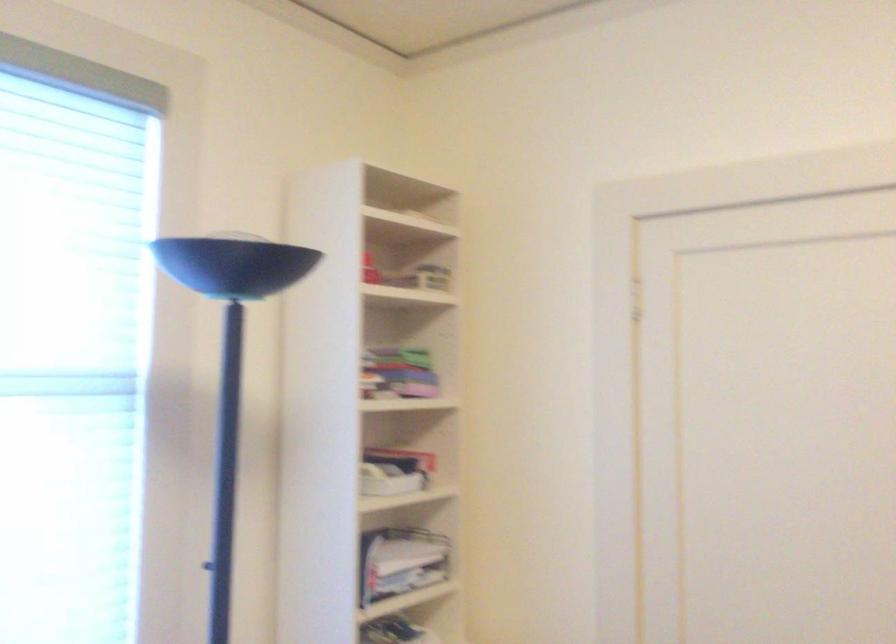
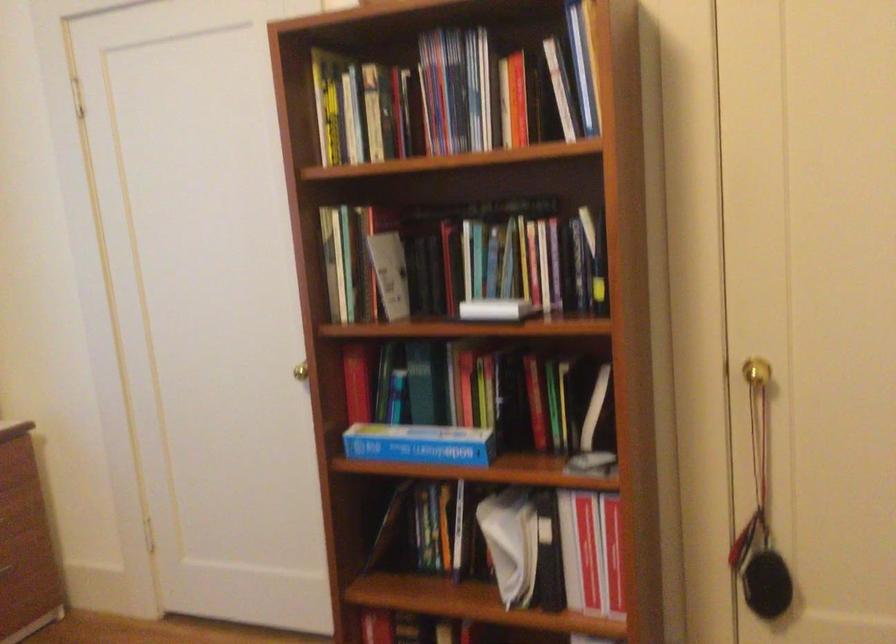
Question: The images are taken continuously from a first-person perspective. In which direction are you moving?

Choices:
 (A) Left
 (B) Right
 (C) Forward
 (D) Backward

Answer: (B)